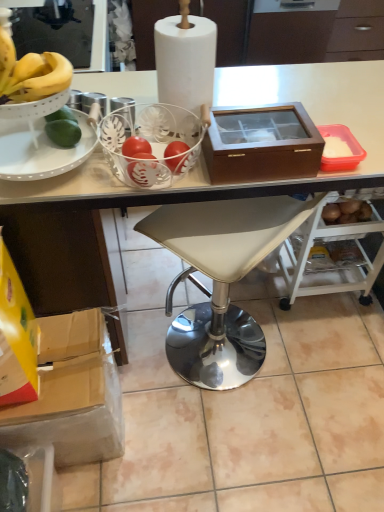
Question: Is point (246, 175) positioned closer to the camera than point (91, 318)?

Choices:
 (A) closer
 (B) farther

Answer: (A)

Question: Considering their positions, is brown wood box at upper right located in front of or behind cardboard box at lower left?

Choices:
 (A) front
 (B) behind

Answer: (A)

Question: Which object is the closest to the brown wood box at upper right?

Choices:
 (A) cardboard box at lower left
 (B) white leather stool at center
 (C) white leather stool at center
 (D) white paper at center

Answer: (D)

Question: Which object is the closest to the white paper at center?

Choices:
 (A) brown wood box at upper right
 (B) white leather stool at center
 (C) white leather stool at center
 (D) cardboard box at lower left

Answer: (A)